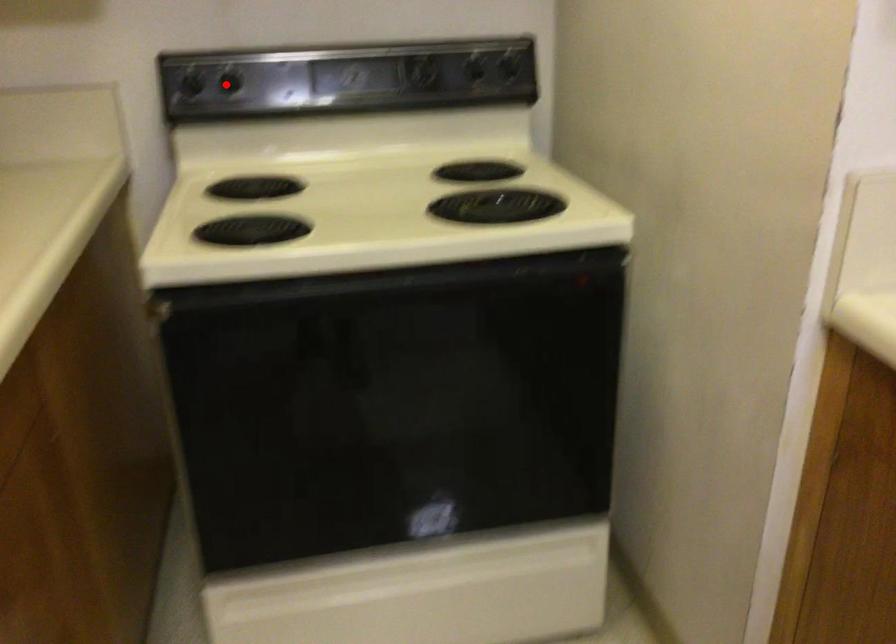
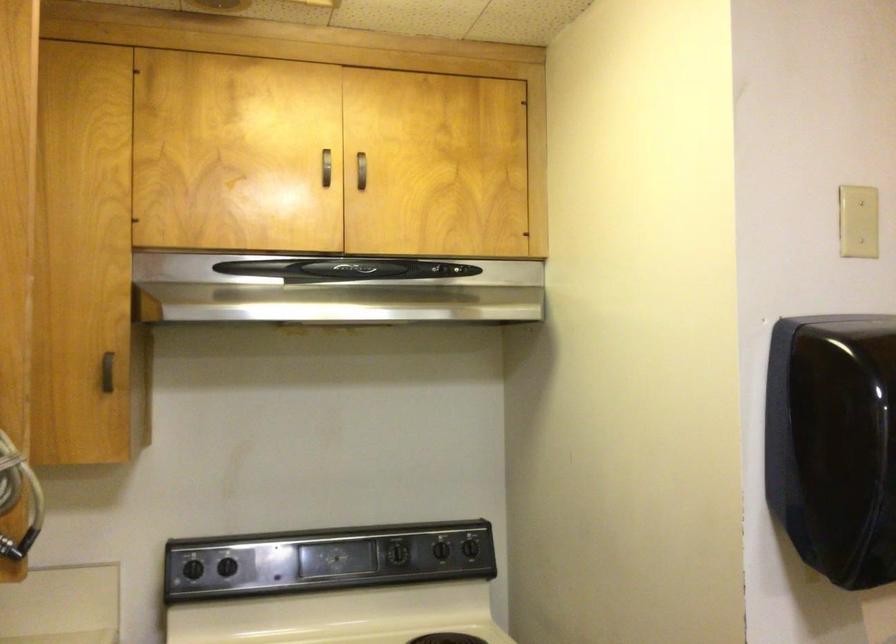
Question: I am providing you with two images of the same scene from different viewpoints. Given a red point in image1, look at the same physical point in image2. Is it:

Choices:
 (A) Closer to the viewpoint
 (B) Farther from the viewpoint

Answer: (B)